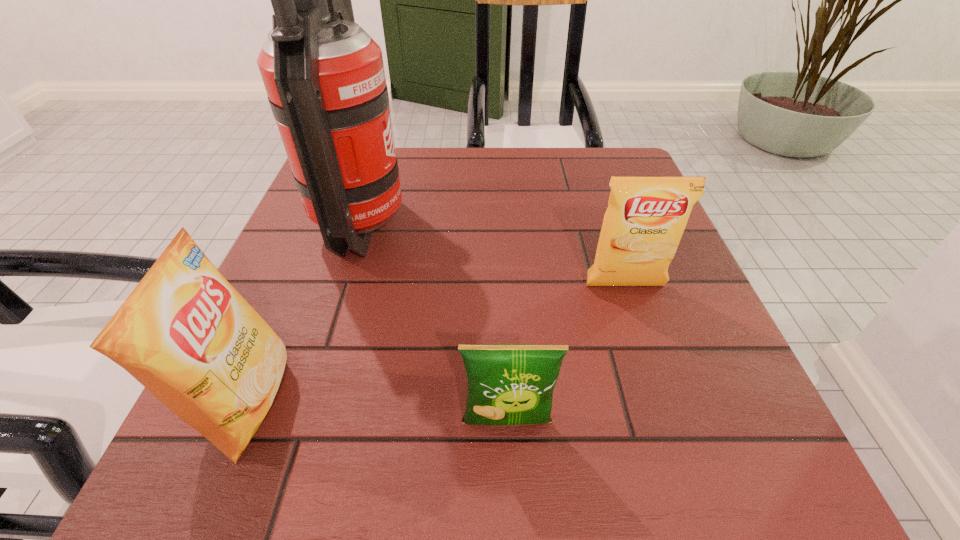
Locate an element on the screen. vacant point located 0.060m on the front-facing side of the second crisp (potato chip) from right to left is located at coordinates (510, 486).

Where is `object positioned at the far edge`? This screenshot has width=960, height=540. object positioned at the far edge is located at coordinates (324, 75).

Find the location of a particular element. This screenshot has height=540, width=960. fire extinguisher present at the left edge is located at coordinates (324, 75).

This screenshot has width=960, height=540. Find the location of `crisp (potato chip) present at the left edge`. crisp (potato chip) present at the left edge is located at coordinates (185, 333).

The width and height of the screenshot is (960, 540). I want to click on object at the right edge, so click(x=642, y=227).

The image size is (960, 540). I want to click on object that is positioned at the far left corner, so click(x=324, y=75).

The height and width of the screenshot is (540, 960). I want to click on object that is at the near left corner, so point(185,333).

In order to click on free region at the far edge of the desktop in this screenshot , I will do `click(512, 168)`.

Where is `vacant region at the near edge`? The image size is (960, 540). vacant region at the near edge is located at coordinates (579, 476).

In order to click on vacant region at the left edge of the desktop in this screenshot , I will do `click(289, 316)`.